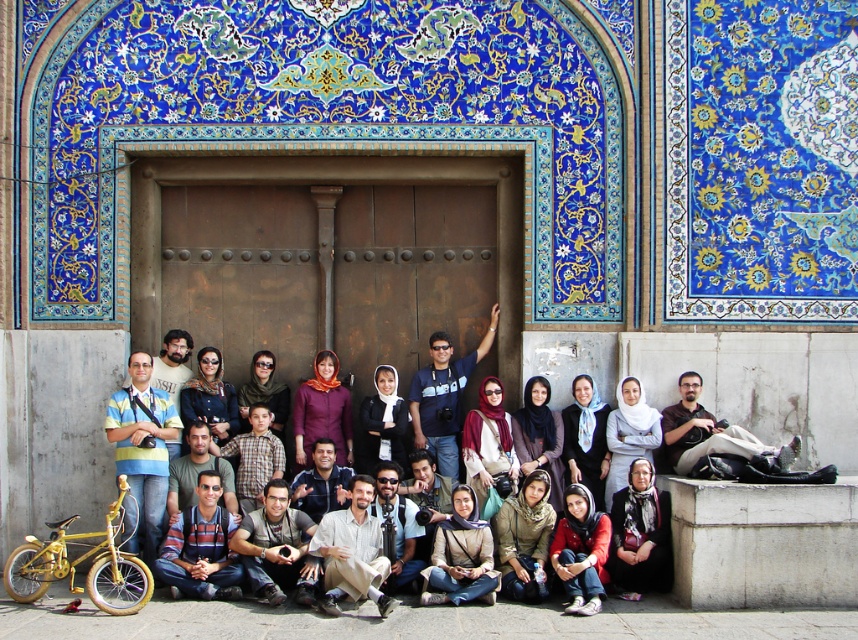
Question: Which point is closer to the camera?

Choices:
 (A) (578, 502)
 (B) (653, 355)
 (C) (662, 566)

Answer: (C)

Question: Considering the real-world distances, which object is farthest from the dark gray scarf at lower center?

Choices:
 (A) matte black bicycle at lower left
 (B) matte red sweater at center

Answer: (A)

Question: Is dark gray scarf at lower center smaller than matte red sweater at center?

Choices:
 (A) no
 (B) yes

Answer: (B)

Question: Which is nearer to the dark gray scarf at lower center?

Choices:
 (A) matte red sweater at center
 (B) matte black bicycle at lower left

Answer: (A)

Question: In this image, where is dark gray scarf at lower center located relative to matte red sweater at center?

Choices:
 (A) right
 (B) left

Answer: (A)

Question: Is matte black bicycle at lower left to the right of dark gray scarf at lower center from the viewer's perspective?

Choices:
 (A) no
 (B) yes

Answer: (A)